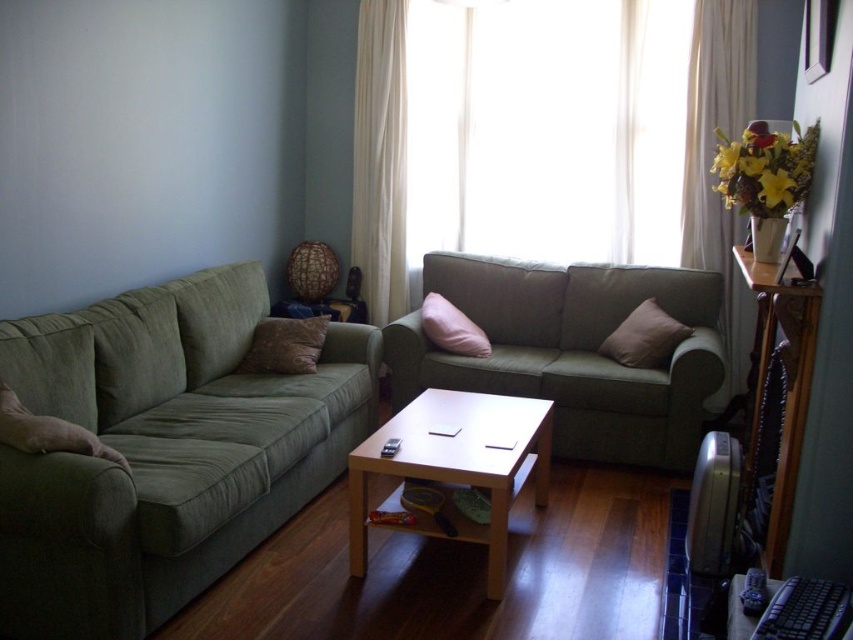
You are sitting on the green suede couch at left and want to reach the wooden table at right to grab a book. Can you easily reach the table from your current position without moving from the couch?

The green suede couch at left is in front of the wooden table at right, meaning the couch is closer to you. To reach the table, you would need to move around or behind the couch to access the table since it is positioned behind the couch from your sitting position.

You are standing in the living room and want to move from the point at coordinates point (541, 269) to the point at coordinates point (735, 292). Can you walk directly between these two points without any obstacles?

Point (541, 269) is behind point (735, 292), so you cannot walk directly between them because the path is blocked by the object at point (735, 292).

You are standing in the living room and want to place a new decorative item on the light brown wooden table at center. Based on the current layout, where exactly should you place it to ensure it doesn not obstruct the view of the items underneath the table?

The light brown wooden table at center is located at point [456,467], so placing the decorative item on the table top would avoid obstructing the view of the items underneath the table.